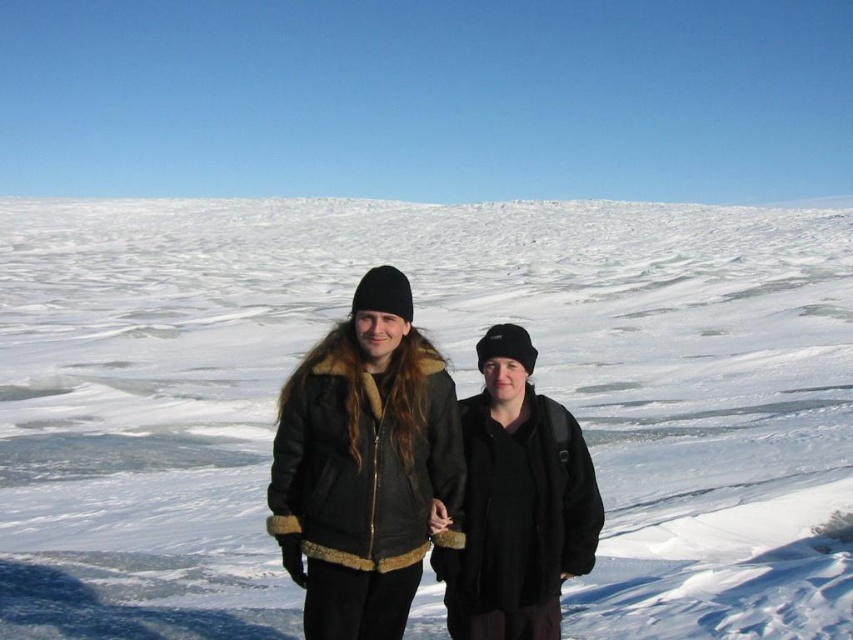
Question: Is leather jacket at center to the left of black matte jacket at center from the viewer's perspective?

Choices:
 (A) yes
 (B) no

Answer: (A)

Question: Can you confirm if white fluffy snow at center is positioned above black matte jacket at center?

Choices:
 (A) no
 (B) yes

Answer: (B)

Question: Is white fluffy snow at center to the right of black matte jacket at center from the viewer's perspective?

Choices:
 (A) no
 (B) yes

Answer: (A)

Question: Which point is farther to the camera?

Choices:
 (A) white fluffy snow at center
 (B) leather jacket at center

Answer: (A)

Question: Which point is farther to the camera?

Choices:
 (A) (416, 396)
 (B) (515, 552)

Answer: (A)

Question: Which of the following is the closest to the observer?

Choices:
 (A) click(697, 637)
 (B) click(482, 422)

Answer: (B)